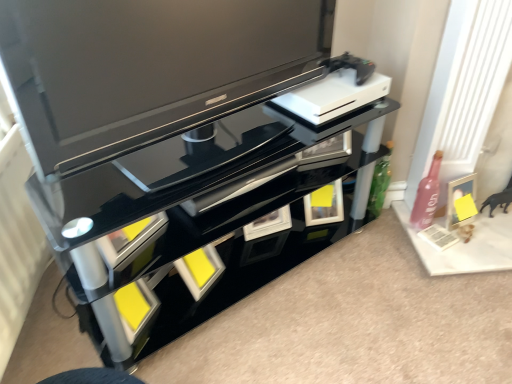
Locate an element on the screen. The image size is (512, 384). free space in front of matte silver picture frame at right is located at coordinates (471, 253).